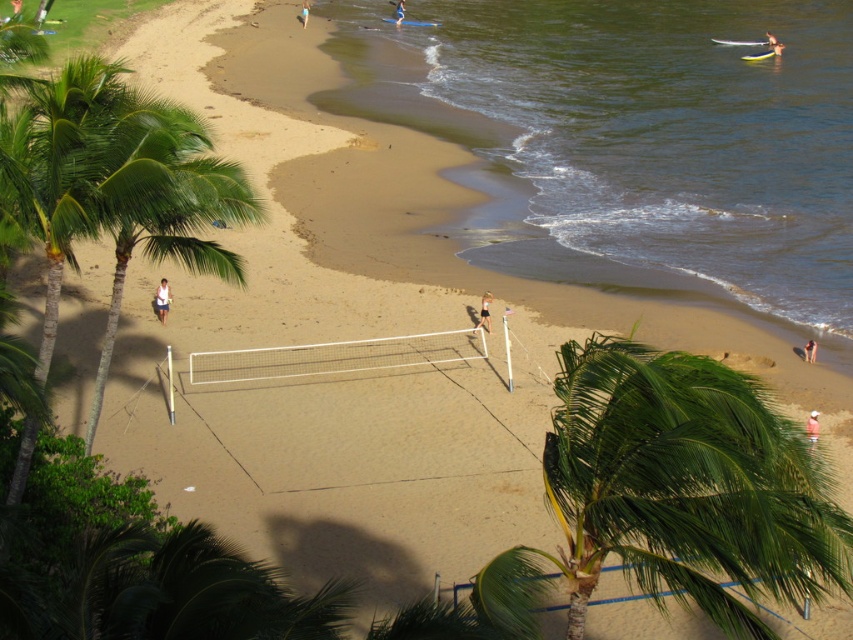
Is tan skin person at center thinner than blue fabric surfboard at upper center?

Yes, tan skin person at center is thinner than blue fabric surfboard at upper center.

Between point (488, 316) and point (398, 20), which one is positioned behind?

The point (398, 20) is more distant.

Find the location of `tan skin person at center`. tan skin person at center is located at coordinates (483, 314).

Does tan skin person at center have a greater width compared to pink fabric shorts at lower right?

Indeed, tan skin person at center has a greater width compared to pink fabric shorts at lower right.

Is tan skin person at center thinner than pink fabric shorts at lower right?

In fact, tan skin person at center might be wider than pink fabric shorts at lower right.

Is point (480, 316) positioned after point (807, 349)?

Yes, point (480, 316) is farther from viewer.

You are a GUI agent. You are given a task and a screenshot of the screen. Output one action in this format:
    pyautogui.click(x=<x>, y=<y>)
    Task: Click on the tan skin person at center
    The image size is (853, 640).
    Given the screenshot: What is the action you would take?
    pyautogui.click(x=483, y=314)

Can you confirm if green leafy palm tree at center is shorter than white fabric shorts at lower center?

Correct, green leafy palm tree at center is not as tall as white fabric shorts at lower center.

Where is `green leafy palm tree at center`? green leafy palm tree at center is located at coordinates (672, 492).